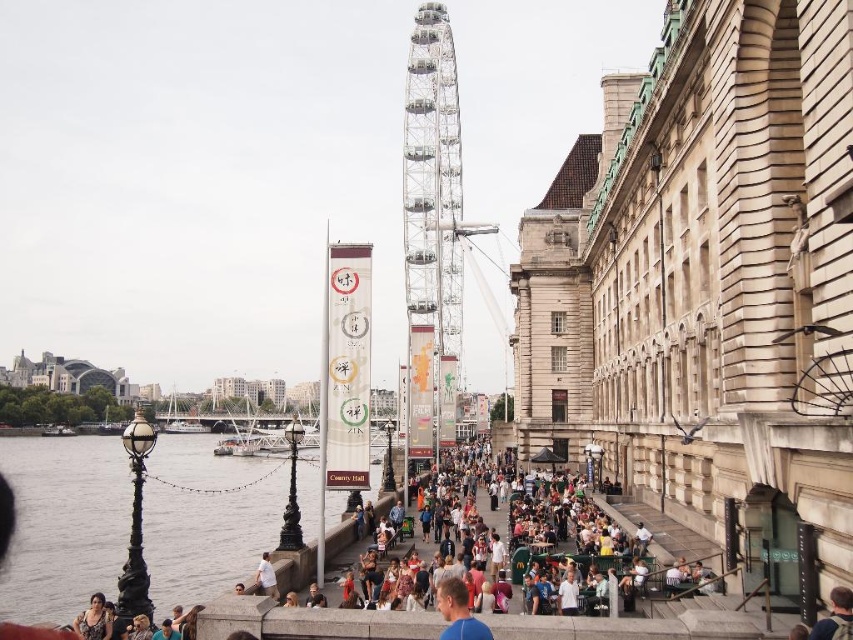
Based on the photo, you are standing on the riverside walkway and want to take a photo of the smooth gray water at lower left. According to the coordinates provided, where should you position yourself to capture the water in your shot?

The smooth gray water at lower left is located at point coordinates (62,524), so you should position yourself to aim your camera towards that coordinate to capture it in your photo.

You are standing at point A located at coordinates point A at point [163,480]. You want to walk to the London Eye, which is located at the other end of the walkway. If your walking speed is 3 feet per second, how many seconds will it take you to reach the London Eye?

The distance between point A at point [163,480] and the London Eye is 500.85 feet. At a walking speed of 3 feet per second, it will take 500.85 divided by 3, which is approximately 166.95 seconds. Rounding to the nearest whole number, it would take about 167 seconds to reach the London Eye.

You are a tourist standing on the riverside walkway and want to take a photo of the London Eye in the background. You notice the smooth gray water at lower left and the matte black dress at lower left in your viewfinder. Which object is positioned lower in the frame?

The smooth gray water at lower left is located below the matte black dress at lower left, so it is positioned lower in the frame.